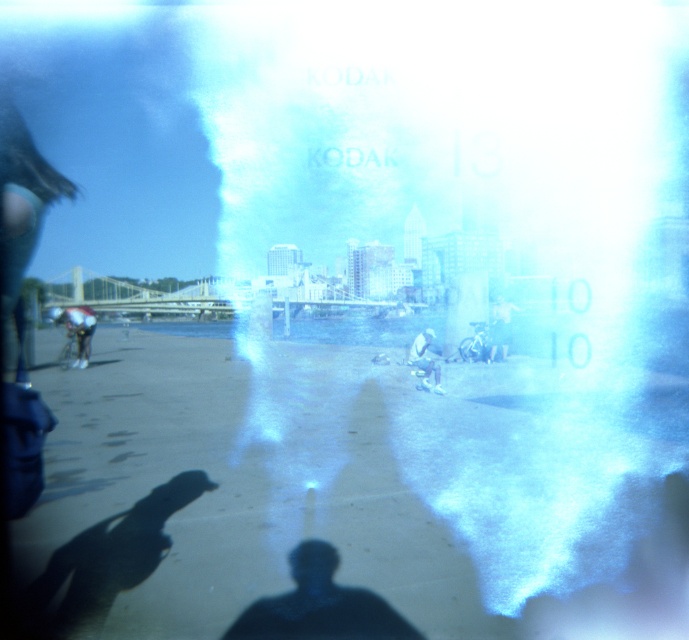
What do you see at coordinates (76, 333) in the screenshot? I see `dark blue fabric cyclist at left` at bounding box center [76, 333].

Can you confirm if dark blue fabric cyclist at left is taller than white matte bicycle at center?

Yes.

Identify the location of dark blue fabric cyclist at left. (76, 333).

Looking at this image, is smooth sand beach at center positioned in front of black matte person at center?

No, it is behind black matte person at center.

Is smooth sand beach at center below black matte person at center?

No, smooth sand beach at center is not below black matte person at center.

Does point (158, 636) lie in front of point (360, 636)?

That is False.

Where is `smooth sand beach at center`? Image resolution: width=689 pixels, height=640 pixels. smooth sand beach at center is located at coordinates (349, 499).

In the scene shown: Who is positioned more to the right, white matte bicycle at center or white plastic bag at center?

white plastic bag at center is more to the right.

Can you confirm if white matte bicycle at center is taller than white plastic bag at center?

No.

Between point (418, 333) and point (493, 332), which one is positioned in front?

Point (493, 332) is more forward.

Identify the location of white matte bicycle at center. This screenshot has height=640, width=689. [424, 360].